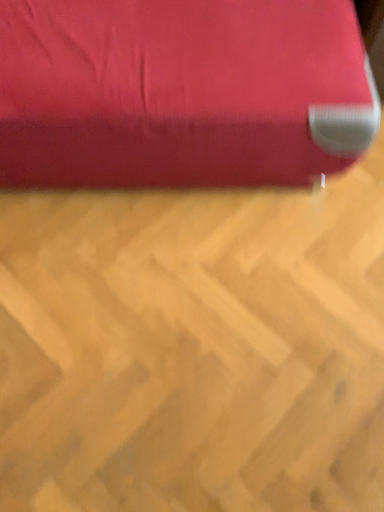
The width and height of the screenshot is (384, 512). What do you see at coordinates (181, 92) in the screenshot? I see `matte red fabric at upper center` at bounding box center [181, 92].

Identify the location of matte red fabric at upper center. The image size is (384, 512). (181, 92).

You are a GUI agent. You are given a task and a screenshot of the screen. Output one action in this format:
    pyautogui.click(x=<x>, y=<y>)
    Task: Click on the matte red fabric at upper center
    
    Given the screenshot: What is the action you would take?
    pyautogui.click(x=181, y=92)